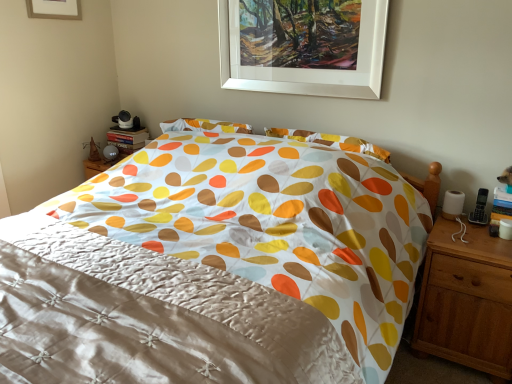
Question: In terms of width, does silky white quilt at center look wider or thinner when compared to white matte picture frame at upper center, which is the second picture frame from top to bottom?

Choices:
 (A) wide
 (B) thin

Answer: (A)

Question: In terms of height, does silky white quilt at center look taller or shorter compared to white matte picture frame at upper center, marked as the 1th picture frame in a bottom-to-top arrangement?

Choices:
 (A) tall
 (B) short

Answer: (A)

Question: Which object is positioned farthest from the silky white quilt at center?

Choices:
 (A) light brown wood nightstand at right
 (B) white matte picture frame at upper center, the 2th picture frame from the left
 (C) white matte picture frame at upper center, arranged as the first picture frame when viewed from the top

Answer: (C)

Question: Estimate the real-world distances between objects in this image. Which object is farther from the silky white quilt at center?

Choices:
 (A) white matte picture frame at upper center, marked as the second picture frame in a bottom-to-top arrangement
 (B) light brown wood nightstand at right
 (C) white matte picture frame at upper center, which is the second picture frame from top to bottom

Answer: (A)